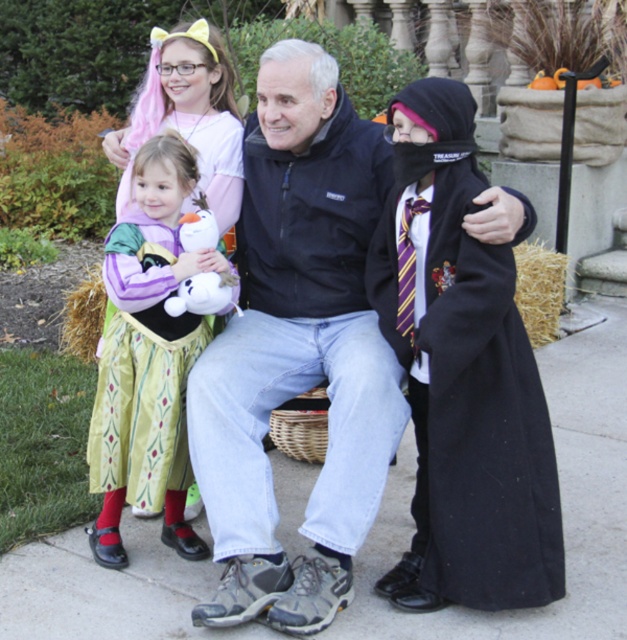
Is matte black coat at center closer to the viewer compared to green satin dress at left?

Yes, it is.

Does matte black coat at center appear on the left side of green satin dress at left?

No, matte black coat at center is not to the left of green satin dress at left.

In order to click on matte black coat at center in this screenshot , I will do `click(297, 348)`.

Between point (371, 451) and point (224, 288), which one is positioned behind?

The point (224, 288) is more distant.

Who is more forward, (337, 278) or (198, 314)?

Point (198, 314) is in front.

The height and width of the screenshot is (640, 627). Identify the location of matte black coat at center. (297, 348).

Is black softshell jacket at center closer to camera compared to green satin dress at left?

Yes, it is in front of green satin dress at left.

Which is more to the right, black softshell jacket at center or green satin dress at left?

Positioned to the right is black softshell jacket at center.

Is point (325, 129) less distant than point (179, 356)?

No, (325, 129) is behind (179, 356).

The height and width of the screenshot is (640, 627). Find the location of `black softshell jacket at center`. black softshell jacket at center is located at coordinates (297, 349).